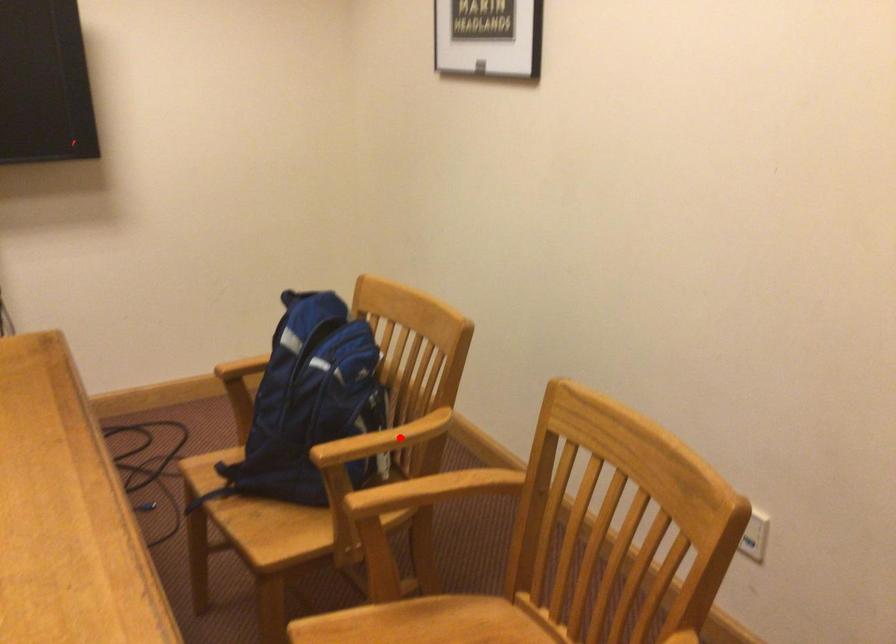
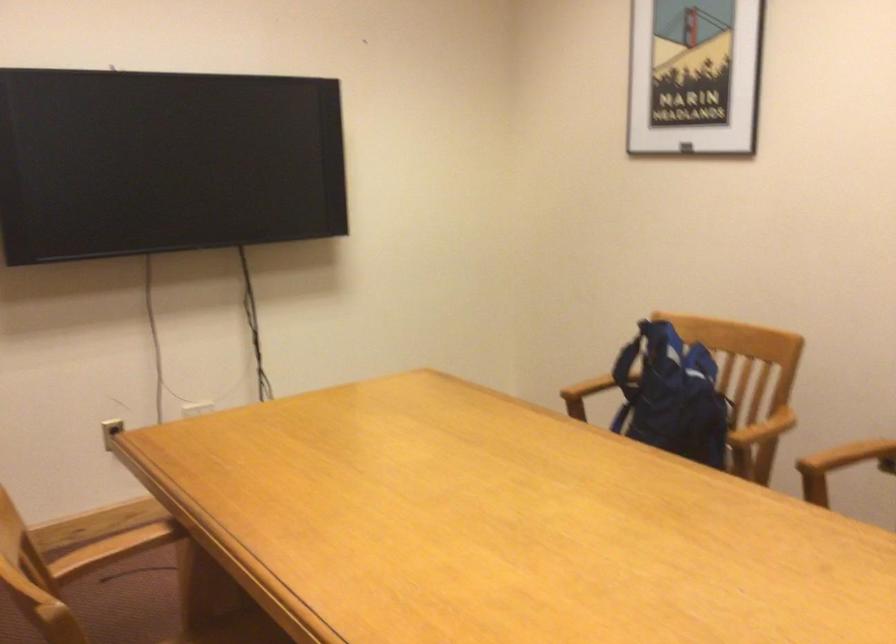
Question: I am providing you with two images of the same scene from different viewpoints. Image1 has a red point marked. In image2, the corresponding 3D location appears at what relative position? Reply with the corresponding letter.

Choices:
 (A) Closer
 (B) Farther

Answer: (B)